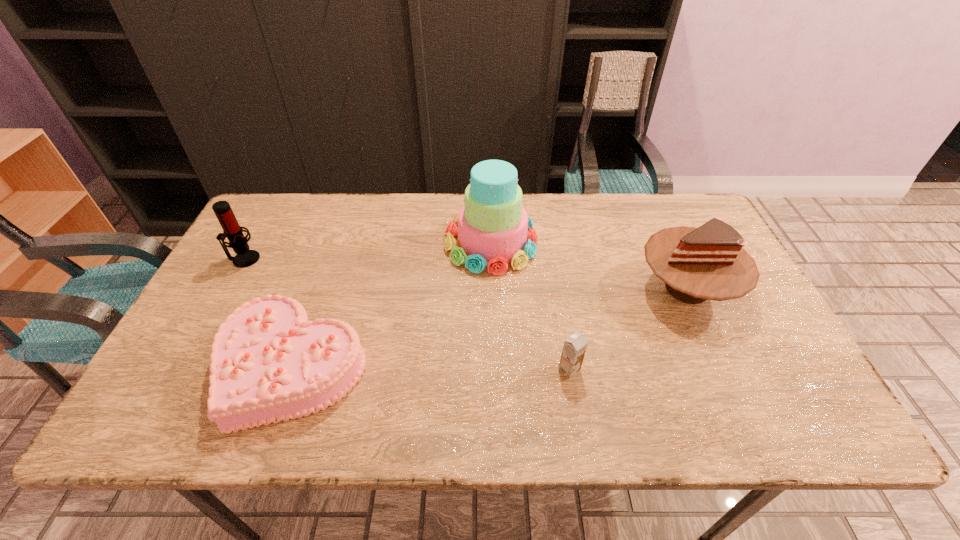
This screenshot has width=960, height=540. Identify the location of blank space that satisfies the following two spatial constraints: 1. on the front side of the fourth object from left to right; 2. on the left side of the fourth object from right to left. (292, 369).